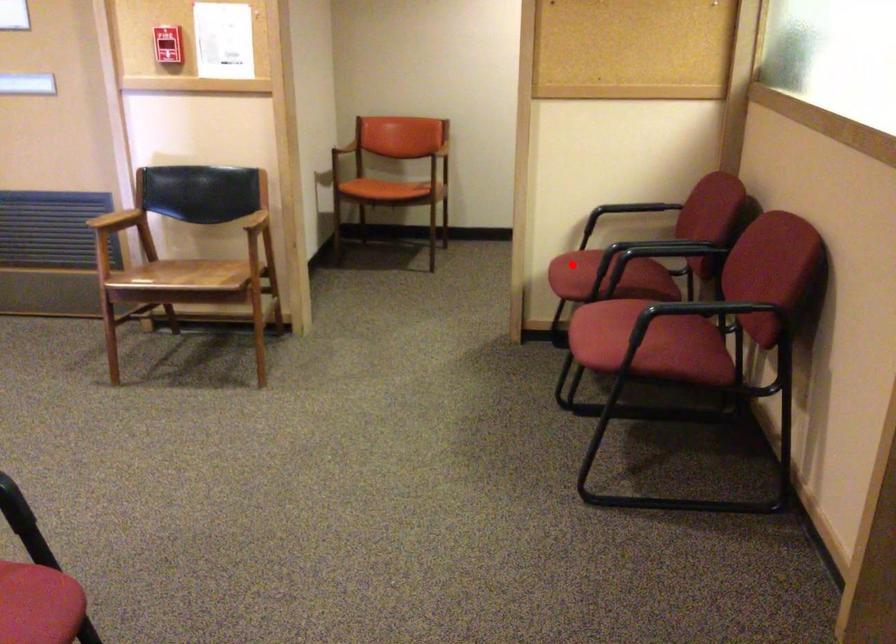
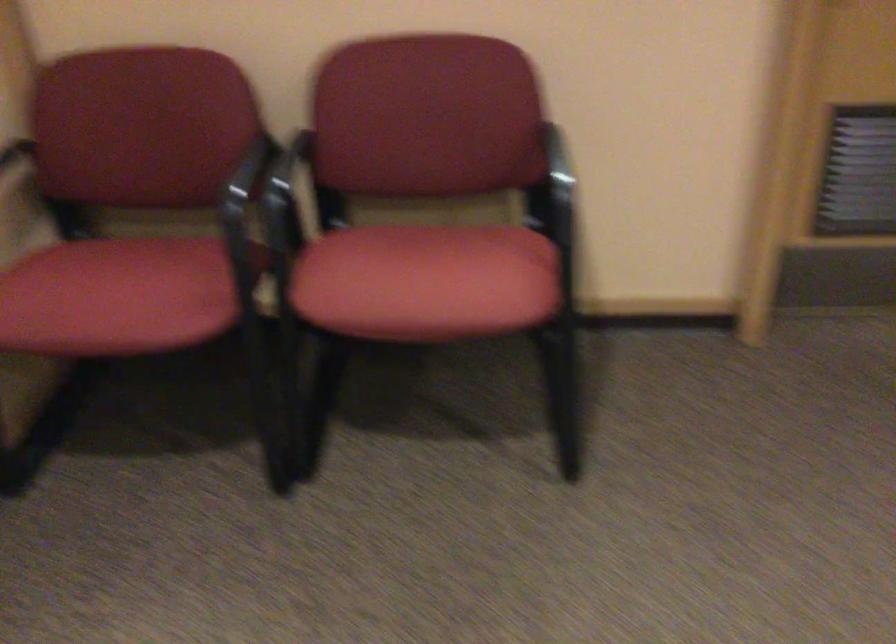
Where in the second image is the point corresponding to the highlighted location from the first image?

(116, 297)